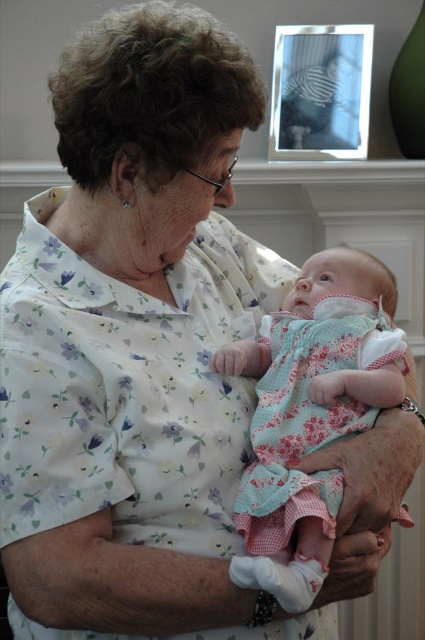
Image resolution: width=425 pixels, height=640 pixels. Describe the element at coordinates (311, 412) in the screenshot. I see `floral fabric baby at center` at that location.

Who is positioned more to the left, floral fabric baby at center or metallic silver picture frame at upper center?

floral fabric baby at center

Locate an element on the screen. This screenshot has width=425, height=640. floral fabric baby at center is located at coordinates (311, 412).

Locate an element on the screen. floral fabric baby at center is located at coordinates (311, 412).